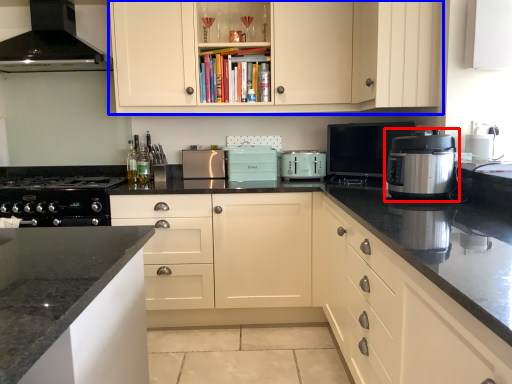
Question: Among these objects, which one is farthest to the camera, kitchen appliance (highlighted by a red box) or cabinetry (highlighted by a blue box)?

Choices:
 (A) kitchen appliance
 (B) cabinetry

Answer: (B)